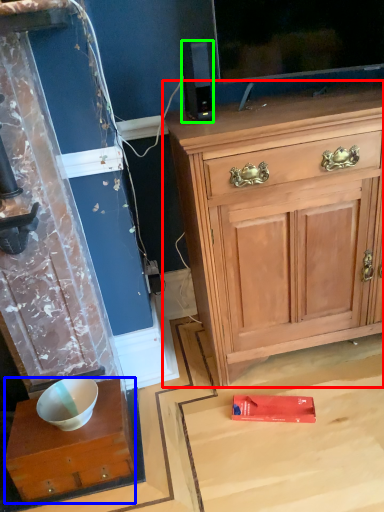
Question: Which is nearer to the cabinetry (highlighted by a red box)? desk (highlighted by a blue box) or loudspeaker (highlighted by a green box).

Choices:
 (A) desk
 (B) loudspeaker

Answer: (B)